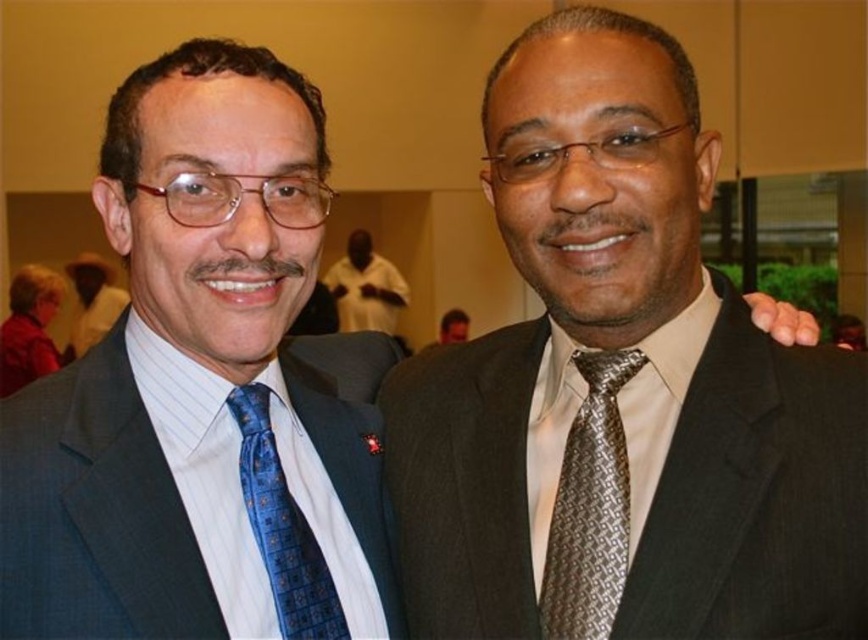
You are taking a photo of two men in a conference room. You want to focus on the point closer to the camera. Which point should you focus on, point (x=316, y=632) or point (x=120, y=292)?

Point (x=316, y=632) is closer to the camera than point (x=120, y=292), so you should focus on point (x=316, y=632).

You are a photographer at a formal event and need to adjust the lighting to ensure both the blue dotted fabric tie at left and the blue satin tie at left are visible. Given their size difference, which tie might require more careful lighting to avoid being overlooked?

The blue dotted fabric tie at left has a smaller size compared to the blue satin tie at left, so it might require more careful lighting to ensure it is visible and not overlooked.